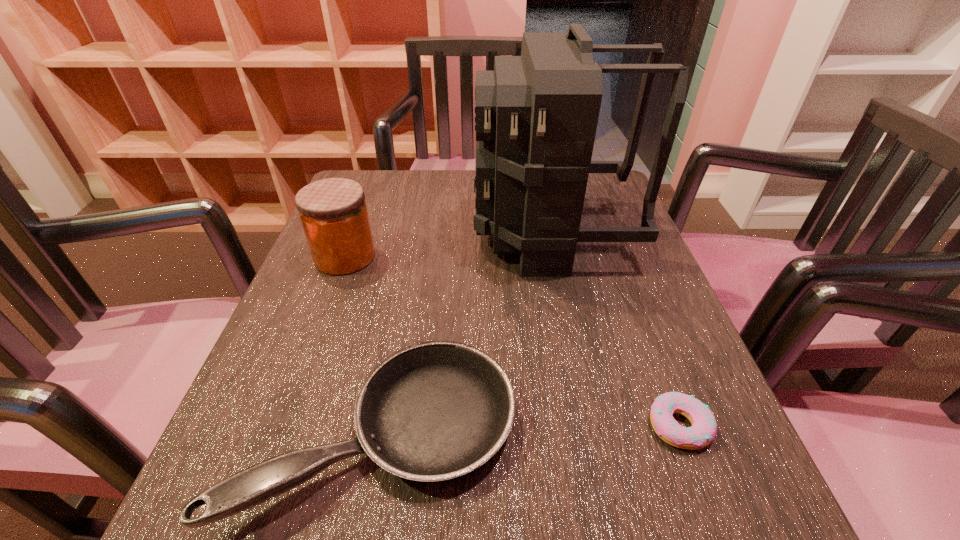
You are a GUI agent. You are given a task and a screenshot of the screen. Output one action in this format:
    pyautogui.click(x=<x>, y=<y>)
    Task: Click on the free space between the doughnut and the backpack
    
    Given the screenshot: What is the action you would take?
    pyautogui.click(x=615, y=330)

The width and height of the screenshot is (960, 540). I want to click on vacant region between the third shortest object and the tallest object, so click(448, 246).

I want to click on object that stands as the second closest to the shortest object, so click(x=536, y=115).

Where is `the third closest object relative to the doughnut`? the third closest object relative to the doughnut is located at coordinates (333, 212).

Identify the location of vacant region that satisfies the following two spatial constraints: 1. on the front compartment of the shortest object; 2. on the right side of the backpack. Image resolution: width=960 pixels, height=540 pixels. (590, 426).

The height and width of the screenshot is (540, 960). In order to click on vacant area that satisfies the following two spatial constraints: 1. on the front compartment of the tallest object; 2. on the front side of the second tallest object in this screenshot , I will do `click(556, 256)`.